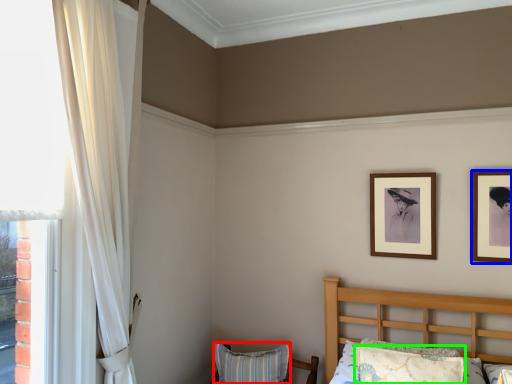
Question: Which object is positioned closest to pillow (highlighted by a red box)? Select from picture frame (highlighted by a blue box) and pillow (highlighted by a green box).

Choices:
 (A) picture frame
 (B) pillow

Answer: (B)